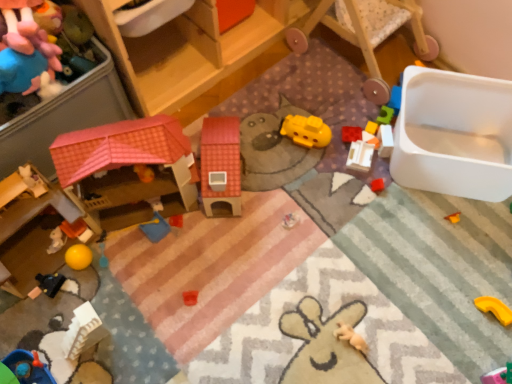
Identify the location of vacant space in between white plastic building at center-right, the eighth toy when ordered from left to right, and blue fabric toy at center, acting as the ninth toy starting from the right. (269, 193).